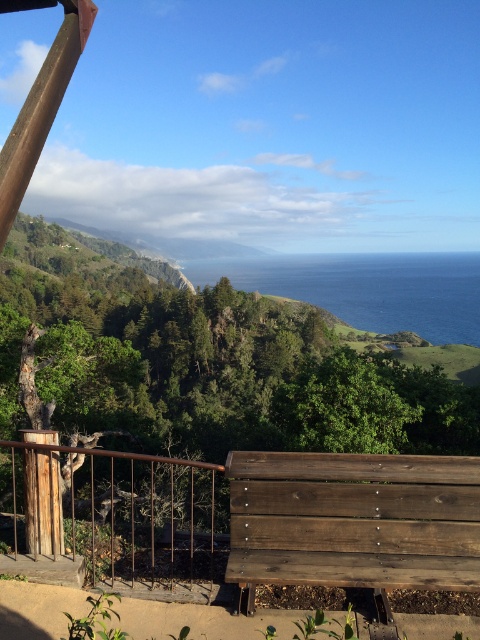
You are standing on a wooden deck overlooking the ocean. You see a dark brown wooden bench at lower center and blue water at center. Which object is nearer to you?

The dark brown wooden bench at lower center is closer to the viewer than the blue water at center.

You are standing on a wooden deck overlooking the coast and want to take a photo of the rusty metal rail at lower left. If your camera has a maximum zoom range of 3 meters, will you be able to capture a clear closeup without moving closer?

The rusty metal rail at lower left is 3.55 meters away from the camera. Since the camera can only zoom up to 3 meters, you won

You are designing a layout for a coastal deck and need to place a new table between the dark brown wooden bench at lower center and the blue water at center. Based on their widths, which object should the table be closer to?

The dark brown wooden bench at lower center has a smaller width than the blue water at center, so the table should be closer to the blue water at center to maintain balance in the layout.